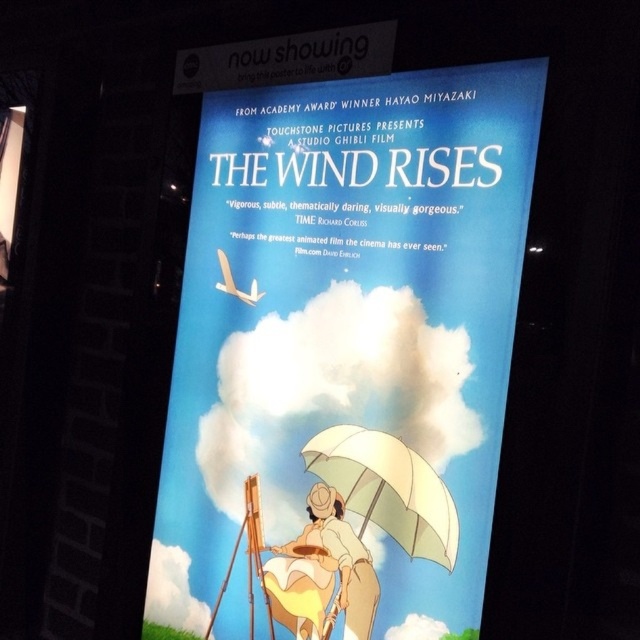
Question: Is matte paper poster at center further to the viewer compared to white matte umbrella at center?

Choices:
 (A) yes
 (B) no

Answer: (B)

Question: Which point is farther to the camera?

Choices:
 (A) (236, 291)
 (B) (384, 500)
 (C) (332, 518)

Answer: (A)

Question: Which point appears farthest from the camera in this image?

Choices:
 (A) (340, 544)
 (B) (262, 355)
 (C) (449, 500)

Answer: (B)

Question: Based on their relative distances, which object is nearer to the matte yellow dress at center?

Choices:
 (A) matte paper poster at center
 (B) white matte umbrella at center

Answer: (B)

Question: Does matte paper poster at center appear on the right side of white matte umbrella at center?

Choices:
 (A) yes
 (B) no

Answer: (B)

Question: Is matte paper poster at center positioned in front of white matte umbrella at center?

Choices:
 (A) no
 (B) yes

Answer: (B)